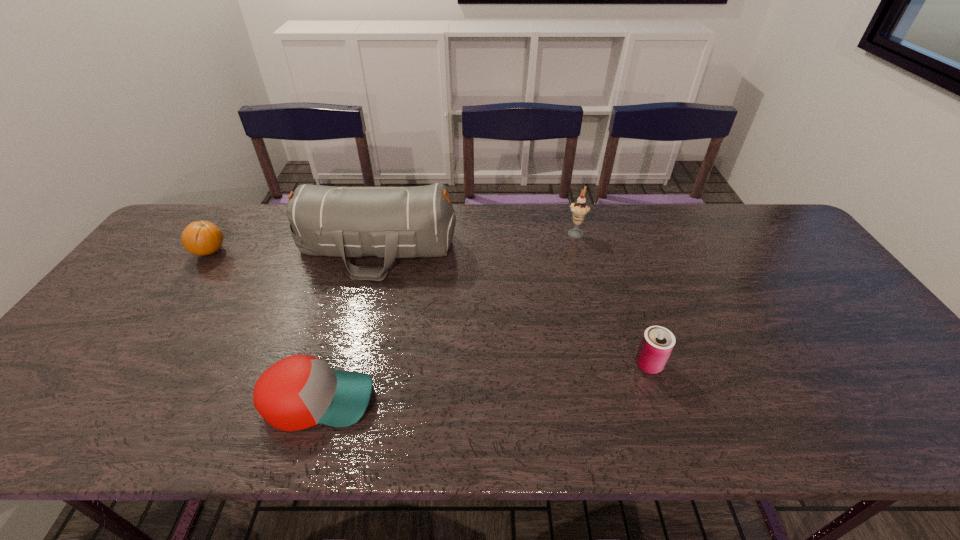
Where is `free area in between the can and the baseball cap`? The height and width of the screenshot is (540, 960). free area in between the can and the baseball cap is located at coordinates (484, 382).

The image size is (960, 540). In order to click on vacant space that's between the can and the leftmost object in this screenshot , I will do `click(429, 308)`.

Identify the location of vacant area between the baseball cap and the leftmost object. point(264,326).

This screenshot has width=960, height=540. Identify the location of object that can be found as the closest to the tallest object. (202, 238).

Locate which object is the second closest to the leftmost object. Please provide its 2D coordinates. Your answer should be formatted as a tuple, i.e. [(x, y)], where the tuple contains the x and y coordinates of a point satisfying the conditions above.

[(300, 391)]